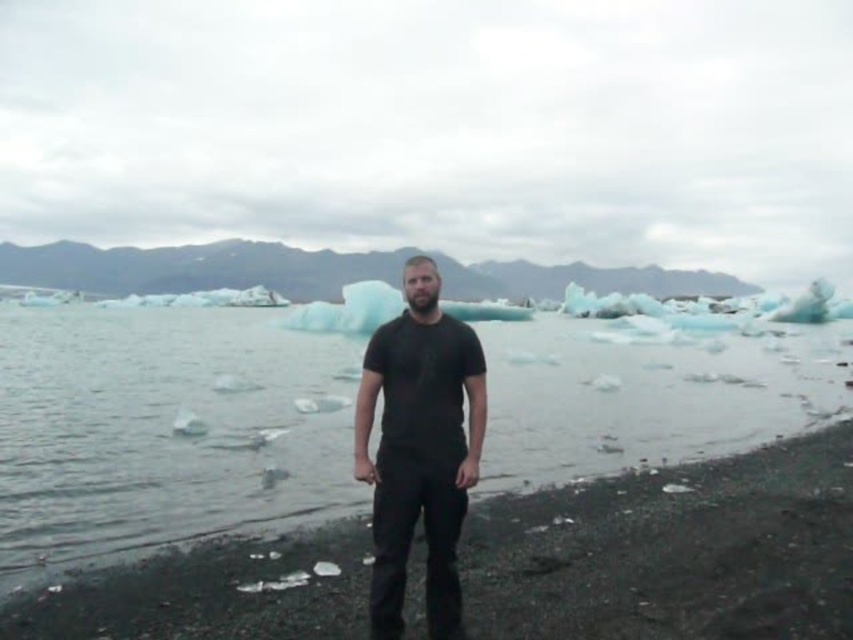
You are a hiker trying to cross the icy water in the image. You see the point marked at coordinates (164, 432). Is this point safe to step on?

The point marked at coordinates (164, 432) is on clear ice water at center, which means the ice there is transparent and possibly thin. It might not be safe to step on as clear ice can be weaker and more prone to breaking compared to opaque or snowy ice.

You are a photographer trying to capture the reflection of the clear ice water at center in your shot. Since the black matte shirt at center might block the reflection, will you need to adjust your position to ensure the reflection is fully visible?

The clear ice water at center has a greater height compared to the black matte shirt at center, so the reflection should be visible without needing to adjust your position as the water is higher than the shirt.

You are a photographer trying to capture the reflection of the clear ice water at center in your shot. Since the black matte shirt at center might block the view, can you adjust your position to see the reflection without the shirt obstructing it?

The clear ice water at center is above the black matte shirt at center, so if you lower your camera angle or position yourself lower, you can capture the reflection of the clear ice water at center without obstruction from the shirt.